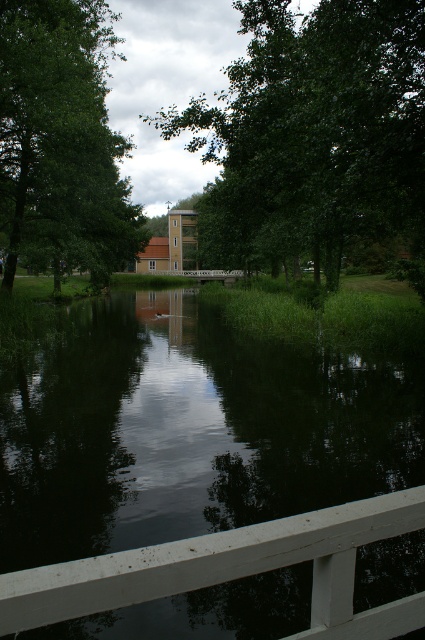
Who is lower down, dark reflective water at center or green leafy tree at center?

dark reflective water at center is below.

Who is shorter, dark reflective water at center or green leafy tree at center?

With less height is dark reflective water at center.

Locate an element on the screen. dark reflective water at center is located at coordinates tap(187, 433).

Image resolution: width=425 pixels, height=640 pixels. I want to click on dark reflective water at center, so click(187, 433).

Is point (244, 236) positioned in front of point (10, 620)?

That is False.

Identify the location of green leafy tree at center. This screenshot has width=425, height=640. (316, 134).

Can you confirm if green leafy tree at center is positioned below green leafy tree at upper left?

Indeed, green leafy tree at center is positioned under green leafy tree at upper left.

Which is more to the left, green leafy tree at center or green leafy tree at upper left?

green leafy tree at upper left is more to the left.

Where is `green leafy tree at center`? This screenshot has width=425, height=640. green leafy tree at center is located at coordinates (316, 134).